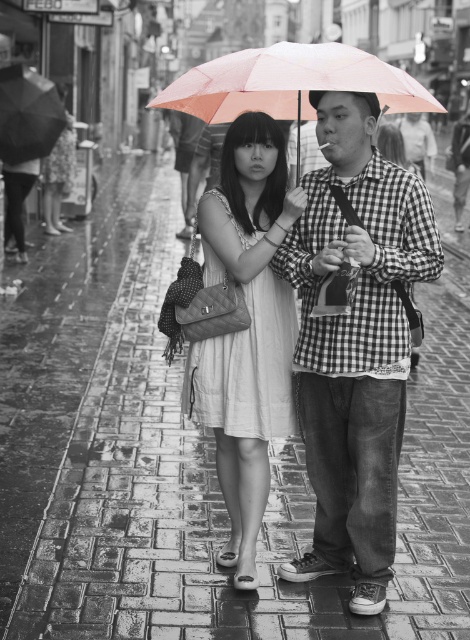
You are a photographer trying to capture the pink translucent umbrella at center in your shot. If the camera has a rectangular viewfinder with coordinates ranging from 0 to 1 on both axes, what is the position of the umbrella relative to the viewfinder?

The pink translucent umbrella at center is located at point 0.130 on the x axis and 0.619 on the y axis within the viewfinder.

You are a photographer trying to capture the man in the checkered fabric shirt at center and the black matte umbrella at upper center in a single frame. Given that the camera can only focus on objects within a 1.2 meter width, will both objects fit in the frame?

The checkered fabric shirt at center has a larger size compared to black matte umbrella at upper center. Since the camera can focus on objects within a 1.2 meter width, both objects can fit in the frame as the shirt is larger but the umbrella is smaller, and their combined size is within the camera range.